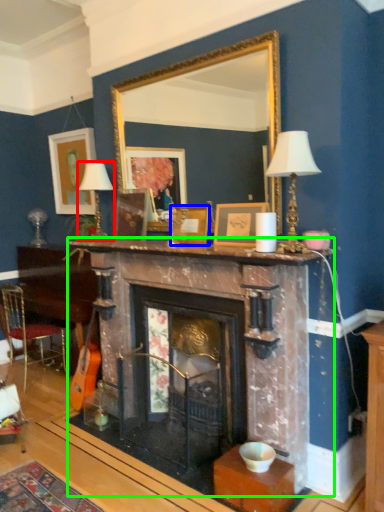
Question: Which object is positioned farthest from table lamp (highlighted by a red box)? Select from picture frame (highlighted by a blue box) and fireplace (highlighted by a green box).

Choices:
 (A) picture frame
 (B) fireplace

Answer: (B)